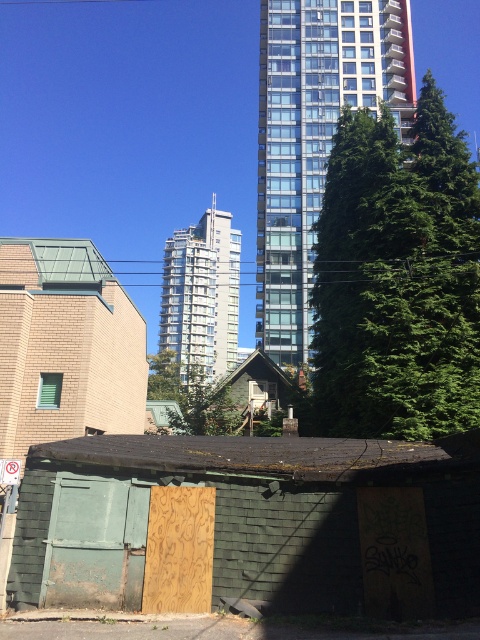
Who is higher up, glassy concrete building at upper center or glassy concrete building at center?

glassy concrete building at upper center is higher up.

Can you confirm if glassy concrete building at upper center is smaller than glassy concrete building at center?

Correct, glassy concrete building at upper center occupies less space than glassy concrete building at center.

Where is `glassy concrete building at upper center`? Image resolution: width=480 pixels, height=640 pixels. glassy concrete building at upper center is located at coordinates (314, 136).

At what (x,y) coordinates should I click in order to perform the action: click on glassy concrete building at upper center. Please return your answer as a coordinate pair (x, y). This screenshot has height=640, width=480. Looking at the image, I should click on pos(314,136).

Consider the image. Is green shingled shed at lower left smaller than glassy concrete building at upper center?

Yes.

Who is taller, green shingled shed at lower left or glassy concrete building at upper center?

glassy concrete building at upper center

The image size is (480, 640). In order to click on green shingled shed at lower left in this screenshot , I will do `click(262, 518)`.

Between green shingled shed at lower left and glassy concrete building at center, which one has more height?

Standing taller between the two is glassy concrete building at center.

Does point (372, 444) come behind point (235, 332)?

No, (372, 444) is in front of (235, 332).

Does point (324, 595) come behind point (204, 308)?

That is False.

You are a GUI agent. You are given a task and a screenshot of the screen. Output one action in this format:
    pyautogui.click(x=<x>, y=<y>)
    Task: Click on the green shingled shed at lower left
    
    Given the screenshot: What is the action you would take?
    pyautogui.click(x=262, y=518)